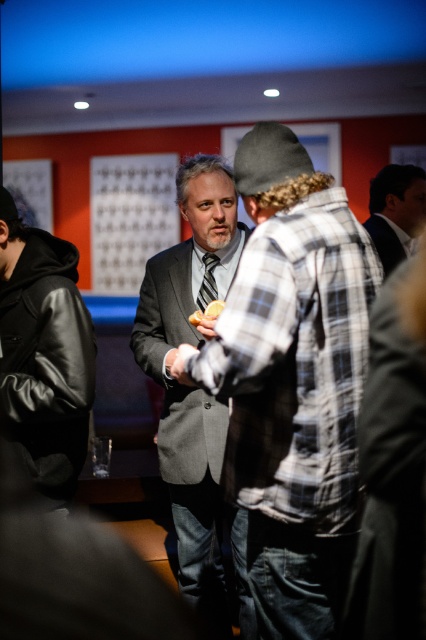
Does point (264, 316) come in front of point (132, 330)?

Yes, it is.

Between plaid flannel shirt at center and gray suit at center, which one is positioned lower?

Positioned lower is gray suit at center.

Describe the element at coordinates (293, 380) in the screenshot. I see `plaid flannel shirt at center` at that location.

Image resolution: width=426 pixels, height=640 pixels. What are the coordinates of `plaid flannel shirt at center` in the screenshot? It's located at (293, 380).

Is plaid flannel shirt at center taller than dark gray suit at upper right?

Yes.

What are the coordinates of `plaid flannel shirt at center` in the screenshot? It's located at (293, 380).

Does gray suit at center appear under black leather jacket at left?

Yes.

This screenshot has width=426, height=640. What do you see at coordinates (195, 387) in the screenshot?
I see `gray suit at center` at bounding box center [195, 387].

Locate an element on the screen. This screenshot has height=640, width=426. gray suit at center is located at coordinates (195, 387).

Locate an element on the screen. The image size is (426, 640). gray suit at center is located at coordinates (195, 387).